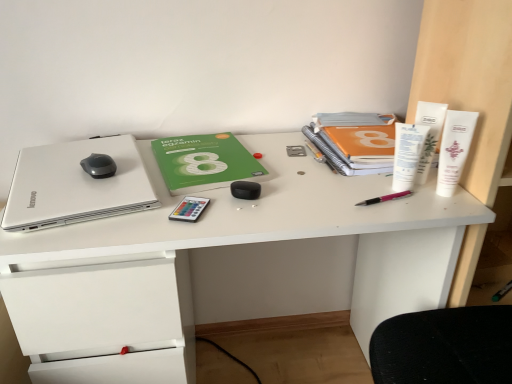
Question: From a real-world perspective, is black rubberized mouse at upper left over white plastic tubes at right, the 3th stationery positioned from the right?

Choices:
 (A) yes
 (B) no

Answer: (B)

Question: Can you confirm if black rubberized mouse at upper left is positioned to the right of white plastic tubes at right, the 3th stationery positioned from the right?

Choices:
 (A) yes
 (B) no

Answer: (B)

Question: Is black rubberized mouse at upper left turned away from white plastic tubes at right, which is the third stationery from left to right?

Choices:
 (A) yes
 (B) no

Answer: (B)

Question: Would you say white plastic tubes at right, the 3th stationery positioned from the right, is part of black rubberized mouse at upper left's contents?

Choices:
 (A) no
 (B) yes

Answer: (A)

Question: Is black rubberized mouse at upper left not close to white plastic tubes at right, the 3th stationery positioned from the right?

Choices:
 (A) yes
 (B) no

Answer: (B)

Question: Is black rubberized mouse at upper left wider than white plastic tubes at right, the 3th stationery positioned from the right?

Choices:
 (A) yes
 (B) no

Answer: (A)

Question: Considering the relative positions of green matte paperback book at center, which appears as the 1th paperback book when viewed from the left, and white matte desk at center in the image provided, is green matte paperback book at center, which appears as the 1th paperback book when viewed from the left, to the left of white matte desk at center from the viewer's perspective?

Choices:
 (A) yes
 (B) no

Answer: (A)

Question: From a real-world perspective, is green matte paperback book at center, which is the second paperback book in right-to-left order, beneath white matte desk at center?

Choices:
 (A) yes
 (B) no

Answer: (B)

Question: Is green matte paperback book at center, which is the second paperback book in right-to-left order, shorter than white matte desk at center?

Choices:
 (A) no
 (B) yes

Answer: (B)

Question: From the image's perspective, would you say green matte paperback book at center, which appears as the 1th paperback book when viewed from the left, is shown under white matte desk at center?

Choices:
 (A) yes
 (B) no

Answer: (B)

Question: Is green matte paperback book at center, which is the second paperback book in right-to-left order, to the right of white matte desk at center from the viewer's perspective?

Choices:
 (A) no
 (B) yes

Answer: (A)

Question: Can you confirm if green matte paperback book at center, which is the second paperback book in right-to-left order, is bigger than white matte desk at center?

Choices:
 (A) yes
 (B) no

Answer: (B)

Question: Is white plastic tube at upper right, which is the fifth stationery in left-to-right order, to the left of green matte paperback book at center, which is the second paperback book in right-to-left order, from the viewer's perspective?

Choices:
 (A) yes
 (B) no

Answer: (B)